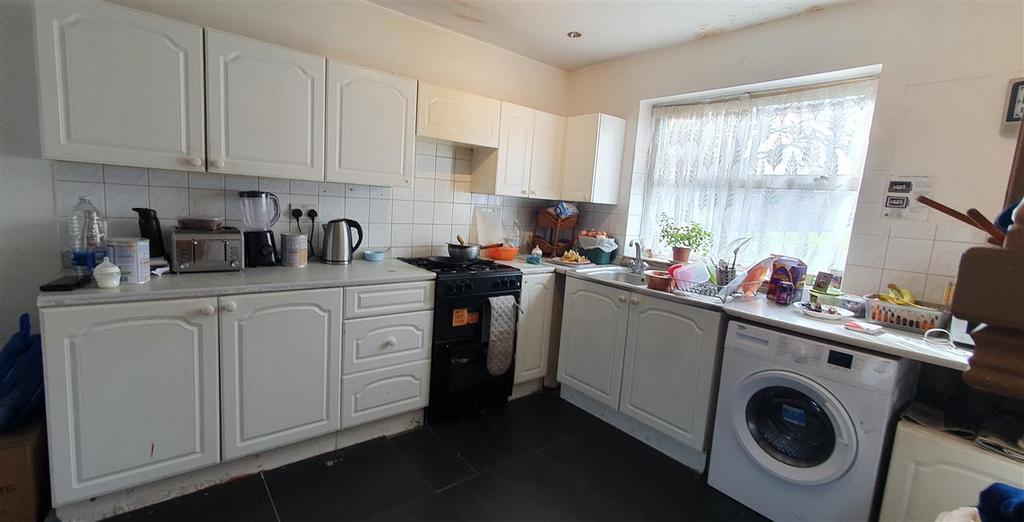
Where is `stovetop`? This screenshot has height=522, width=1024. stovetop is located at coordinates (447, 267).